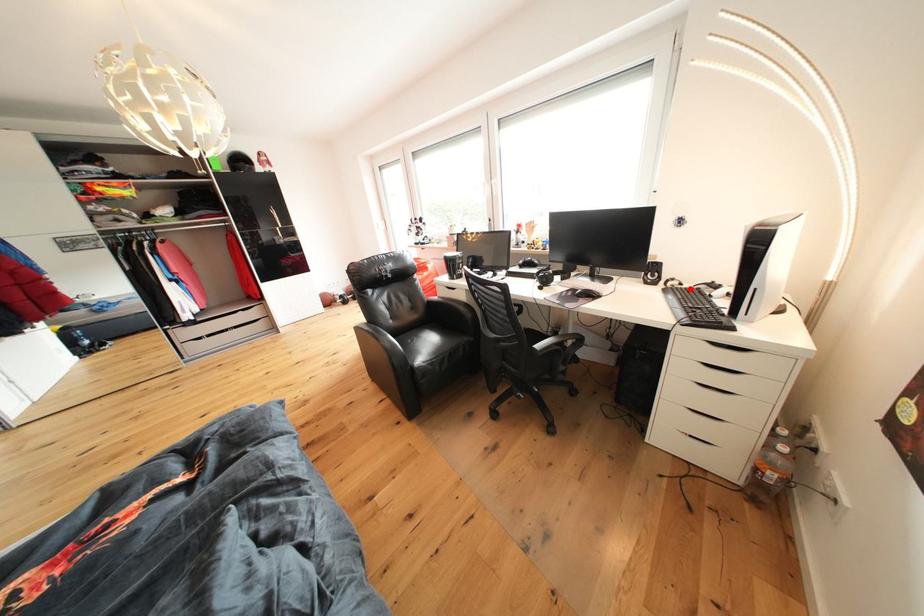
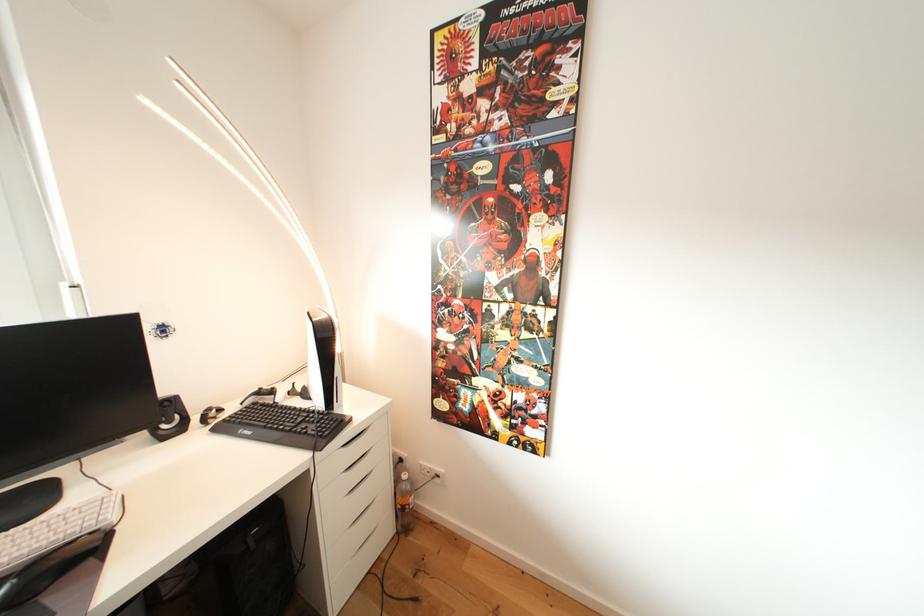
The point at the highlighted location is marked in the first image. Where is the corresponding point in the second image?

(228, 415)